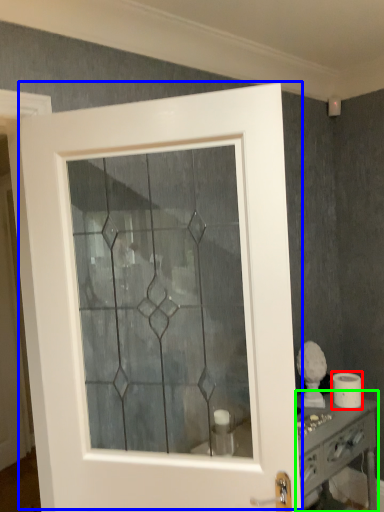
Question: Estimate the real-world distances between objects in this image. Which object is closer to toilet paper (highlighted by a red box), door (highlighted by a blue box) or vanity (highlighted by a green box)?

Choices:
 (A) door
 (B) vanity

Answer: (B)